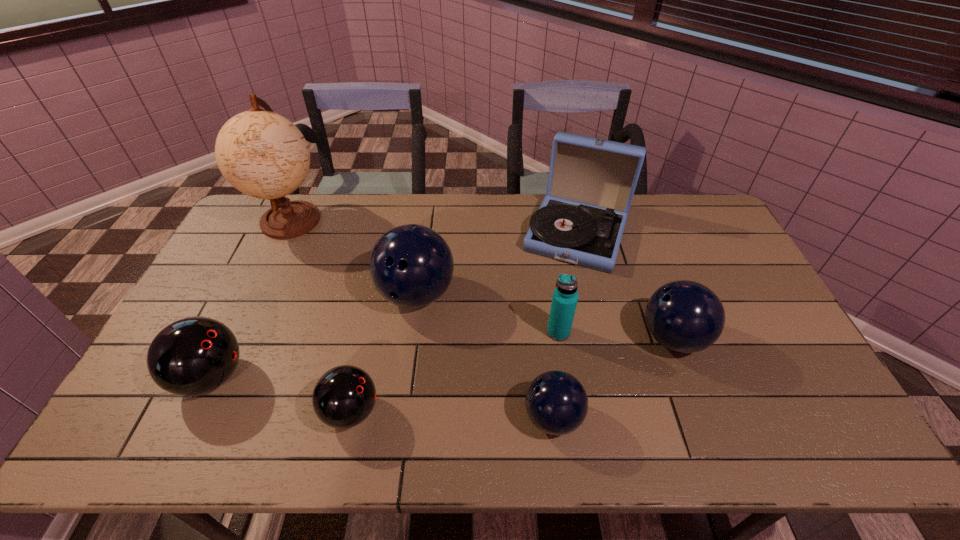
Where is `free spot located 0.230m on the surface of the rightmost bowling ball near the finger holes`? free spot located 0.230m on the surface of the rightmost bowling ball near the finger holes is located at coordinates (556, 338).

Where is `vacant space located on the surface of the bigger black bowling ball near the finger holes`? The image size is (960, 540). vacant space located on the surface of the bigger black bowling ball near the finger holes is located at coordinates (268, 377).

Locate an element on the screen. vacant space located 0.330m on the surface of the nearest blue bowling ball near the finger holes is located at coordinates (387, 417).

Identify the location of vacant space located 0.350m on the surface of the nearest blue bowling ball near the finger holes. (378, 417).

The image size is (960, 540). What are the coordinates of `vacant space located on the surface of the nearest blue bowling ball near the finger holes` in the screenshot? It's located at (432, 417).

This screenshot has height=540, width=960. What are the coordinates of `vacant point located on the surface of the right black bowling ball near the finger holes` in the screenshot? It's located at (491, 411).

This screenshot has width=960, height=540. What are the coordinates of `globe positioned at the far edge` in the screenshot? It's located at (262, 154).

In order to click on phonograph record positioned at the far edge in this screenshot , I will do `click(591, 183)`.

Where is `globe located at the left edge`? The image size is (960, 540). globe located at the left edge is located at coordinates (262, 154).

Image resolution: width=960 pixels, height=540 pixels. I want to click on bowling ball present at the left edge, so click(192, 356).